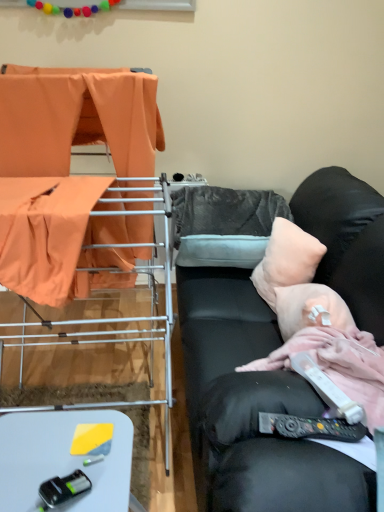
Question: Considering the positions of point (48, 223) and point (354, 415), is point (48, 223) closer or farther from the camera than point (354, 415)?

Choices:
 (A) farther
 (B) closer

Answer: (A)

Question: Do you think orange fabric at left, marked as the second furniture in a front-to-back arrangement, is within white plastic remote control at lower right, which is the second equipment in left-to-right order, or outside of it?

Choices:
 (A) outside
 (B) inside

Answer: (A)

Question: Which is nearer to the gray fuzzy pillow at center, which is the 1th pillow in back-to-front order?

Choices:
 (A) white plastic remote control at lower right, which is the first equipment in right-to-left order
 (B) metal drying rack at left, the 2th furniture from the back
 (C) black leather couch at right
 (D) white plastic table at lower left
 (E) black plastic toy car at lower left, which is the 1th equipment in left-to-right order

Answer: (C)

Question: Which object is positioned closest to the orange fabric at left, the first furniture when ordered from back to front?

Choices:
 (A) black leather couch at right
 (B) metal drying rack at left, which ranks as the 1th furniture in front-to-back order
 (C) white plastic remote control at lower right, which is the second equipment in left-to-right order
 (D) pink fabric at right
 (E) gray fuzzy pillow at center, the second pillow in the front-to-back sequence

Answer: (B)